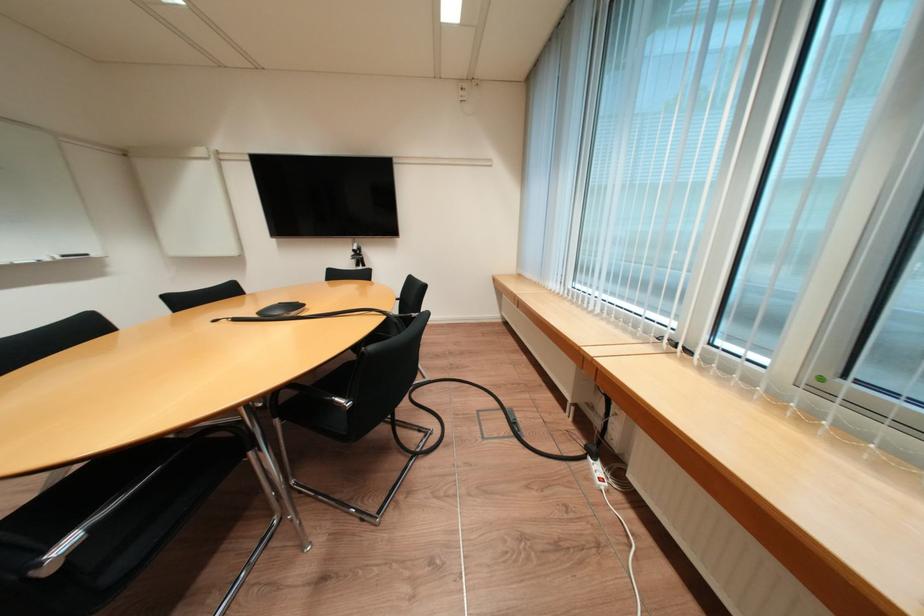
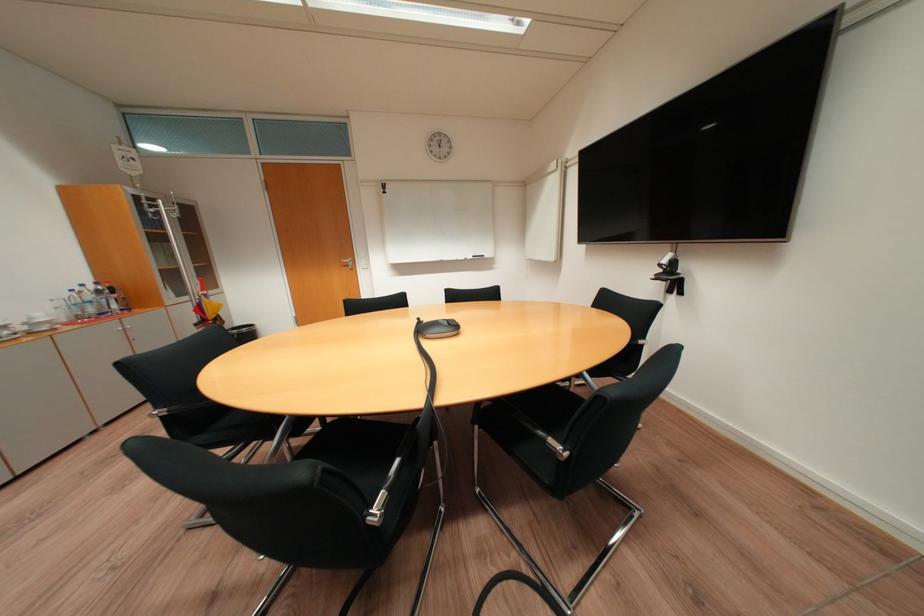
Find the pixel in the second image that matches point 79,541 in the first image.

(176, 411)